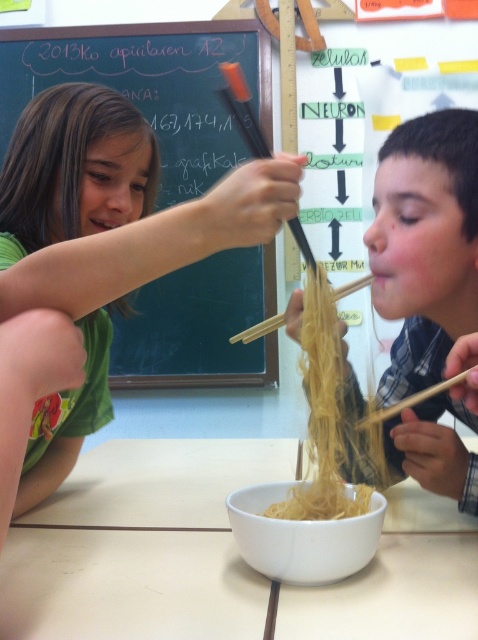
Which is below, yellow matte noodles at center or smooth wood chopstick at center?

yellow matte noodles at center

You are a GUI agent. You are given a task and a screenshot of the screen. Output one action in this format:
    pyautogui.click(x=<x>, y=<y>)
    Task: Click on the yellow matte noodles at center
    
    Given the screenshot: What is the action you would take?
    pyautogui.click(x=424, y=244)

The width and height of the screenshot is (478, 640). I want to click on yellow matte noodles at center, so click(424, 244).

Does point (225, 381) come in front of point (406, 406)?

No, it is not.

Locate an element on the screen. chalkboard at upper left is located at coordinates (151, 84).

Does wooden chopstick at right have a greater height compared to smooth wood chopstick at center?

Incorrect, wooden chopstick at right's height is not larger of smooth wood chopstick at center's.

From the picture: Is wooden chopstick at right positioned at the back of smooth wood chopstick at center?

No, wooden chopstick at right is in front of smooth wood chopstick at center.

Is point (404, 401) positioned behind point (359, 285)?

No.

Locate an element on the screen. This screenshot has height=640, width=478. wooden chopstick at right is located at coordinates (410, 401).